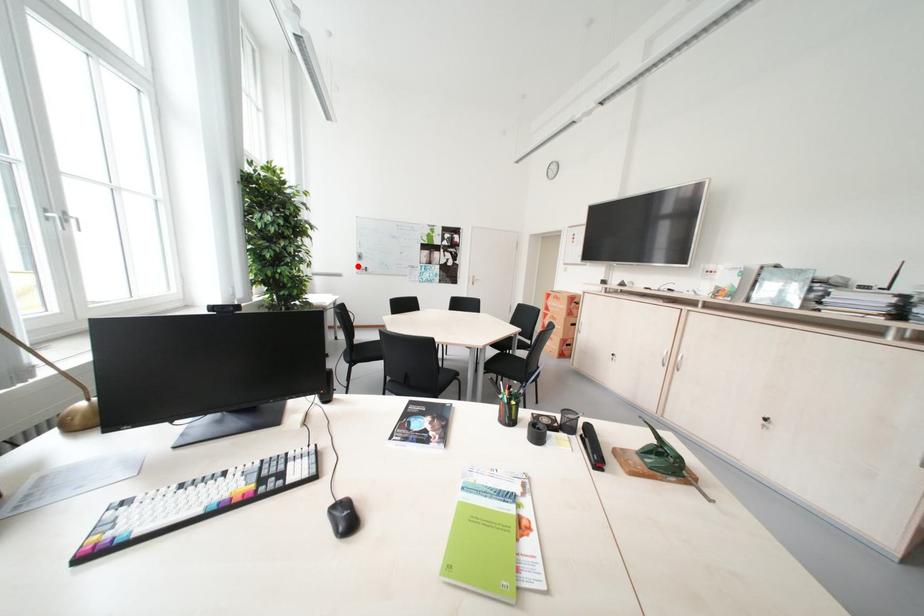
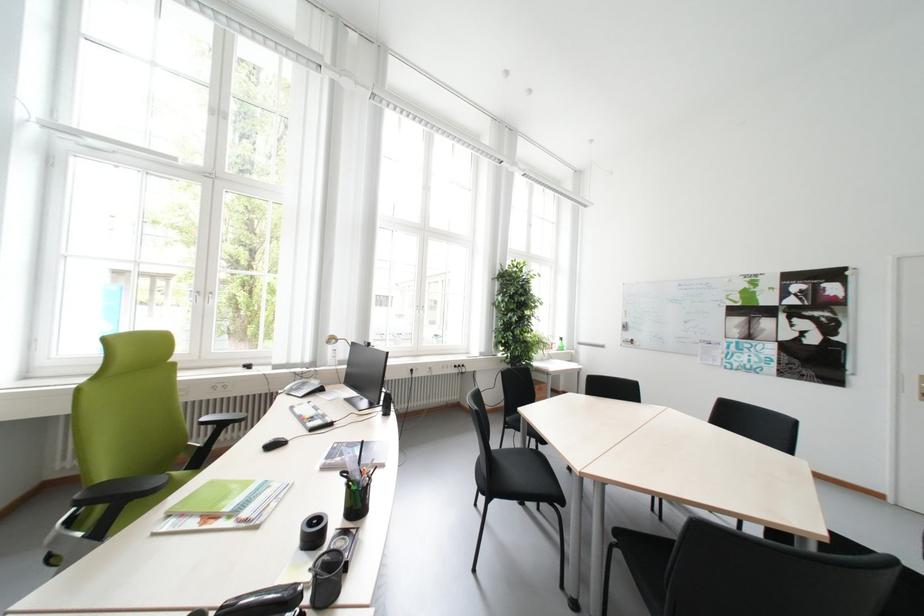
In the second image, find the point that corresponds to the highlighted location in the first image.

(621, 338)